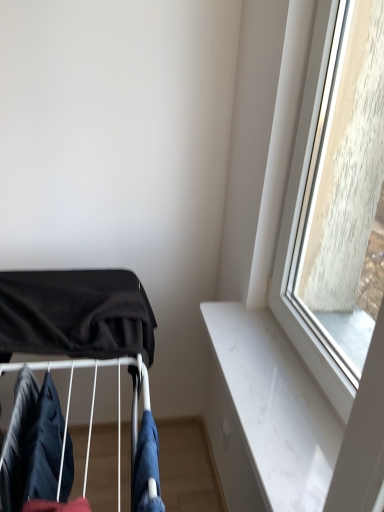
Question: From a real-world perspective, is black fabric baby carriage at left located higher than dark blue fabric at lower left, the 2th clothing positioned from the left?

Choices:
 (A) no
 (B) yes

Answer: (B)

Question: Is black fabric baby carriage at left closer to the viewer compared to dark blue fabric at lower left, the 2th clothing positioned from the left?

Choices:
 (A) no
 (B) yes

Answer: (A)

Question: Can dark blue fabric at lower left, arranged as the 2th clothing when viewed from the right, be found inside black fabric baby carriage at left?

Choices:
 (A) yes
 (B) no

Answer: (B)

Question: Does black fabric baby carriage at left have a lesser height compared to dark blue fabric at lower left, arranged as the 2th clothing when viewed from the right?

Choices:
 (A) yes
 (B) no

Answer: (B)

Question: Is the depth of black fabric baby carriage at left greater than that of dark blue fabric at lower left, arranged as the 2th clothing when viewed from the right?

Choices:
 (A) yes
 (B) no

Answer: (A)

Question: Considering the relative sizes of black fabric baby carriage at left and dark blue fabric at lower left, the 2th clothing positioned from the left, in the image provided, is black fabric baby carriage at left taller than dark blue fabric at lower left, the 2th clothing positioned from the left,?

Choices:
 (A) yes
 (B) no

Answer: (A)

Question: Can you confirm if dark blue fabric at lower left, positioned as the 3th clothing in right-to-left order, is thinner than denim fabric at lower center, which is the 1th clothing from right to left?

Choices:
 (A) yes
 (B) no

Answer: (B)

Question: From the image's perspective, is dark blue fabric at lower left, the 1th clothing in the left-to-right sequence, located beneath denim fabric at lower center, the third clothing when ordered from left to right?

Choices:
 (A) no
 (B) yes

Answer: (A)

Question: Can you confirm if dark blue fabric at lower left, positioned as the 3th clothing in right-to-left order, is smaller than denim fabric at lower center, which is the 1th clothing from right to left?

Choices:
 (A) no
 (B) yes

Answer: (A)

Question: From a real-world perspective, does dark blue fabric at lower left, positioned as the 3th clothing in right-to-left order, sit lower than denim fabric at lower center, which is the 1th clothing from right to left?

Choices:
 (A) yes
 (B) no

Answer: (B)

Question: Is dark blue fabric at lower left, the 1th clothing in the left-to-right sequence, positioned in front of denim fabric at lower center, the third clothing when ordered from left to right?

Choices:
 (A) yes
 (B) no

Answer: (B)

Question: From the image's perspective, is dark blue fabric at lower left, positioned as the 3th clothing in right-to-left order, on denim fabric at lower center, the third clothing when ordered from left to right?

Choices:
 (A) yes
 (B) no

Answer: (A)

Question: Is denim fabric at lower center, which is the 1th clothing from right to left, further to the viewer compared to dark blue fabric at lower left, the 2th clothing positioned from the left?

Choices:
 (A) no
 (B) yes

Answer: (A)